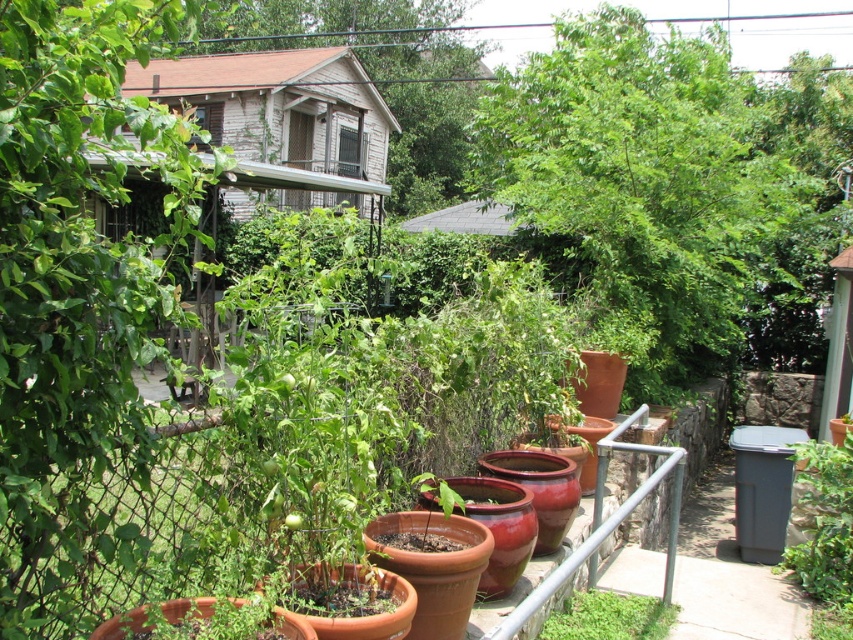
You are standing in the garden and want to reach a point that is exactly 5 meters away from your current position. Is the point at coordinates point (833, 474) within that 5 meter range?

The distance between point (833, 474) and the viewer is 4.88 meters, which is less than 5 meters. Therefore, the point at coordinates point (833, 474) is within the 5 meter range.

You are standing in the backyard garden and want to take a photo of both the point at coordinates point [808,509] and the point at coordinates point [576,595]. Which point should you focus on first to ensure both are in focus?

You should focus on point [576,595] first because it is closer to you than point [808,509], which is further away. By focusing on the closer point, the depth of field may include both points in the photo.

You are a gardener who wants to plant a new green matte plant in the backyard garden. You have two options for placement based on the existing plants. Which existing plant, the green matte plant at lower right or the green matte plant at lower center, has a smaller width and thus requires less space?

The green matte plant at lower right has a smaller width than the green matte plant at lower center, so it requires less space.